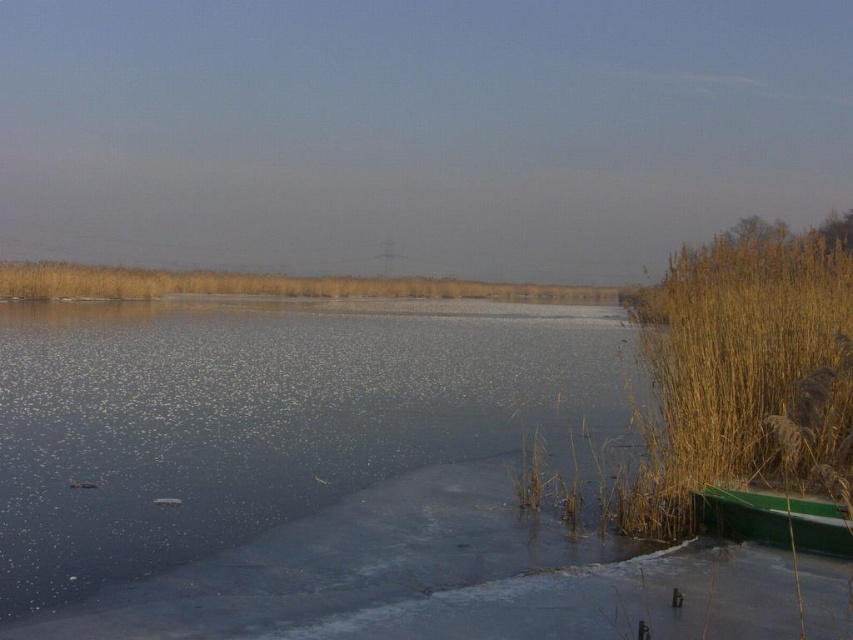
Question: Observing the image, what is the correct spatial positioning of translucent ice at center in reference to brown grass at center?

Choices:
 (A) below
 (B) above

Answer: (A)

Question: Does brown grass at center have a lesser width compared to green plastic canoe at lower right?

Choices:
 (A) no
 (B) yes

Answer: (A)

Question: Which of the following is the farthest from the observer?

Choices:
 (A) (35, 284)
 (B) (814, 532)

Answer: (A)

Question: Does translucent ice at center have a lesser width compared to green plastic canoe at lower right?

Choices:
 (A) yes
 (B) no

Answer: (B)

Question: Which point is closer to the camera taking this photo?

Choices:
 (A) (500, 291)
 (B) (323, 460)
 (C) (744, 502)

Answer: (C)

Question: Among these objects, which one is farthest from the camera?

Choices:
 (A) brown grass at center
 (B) translucent ice at center
 (C) green plastic canoe at lower right

Answer: (A)